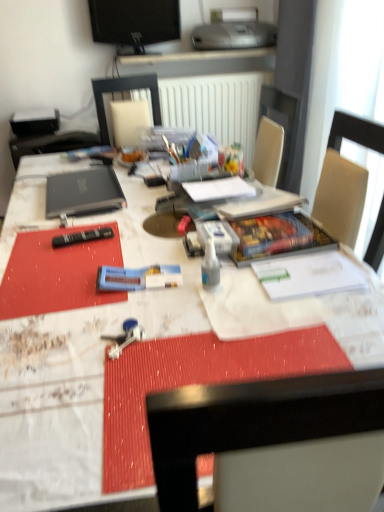
Question: In terms of height, does transparent plastic bottle at center look taller or shorter compared to black matte laptop at left?

Choices:
 (A) short
 (B) tall

Answer: (B)

Question: In the image, is transparent plastic bottle at center on the left side or the right side of black matte laptop at left?

Choices:
 (A) right
 (B) left

Answer: (A)

Question: Considering the real-world distances, which object is closest to the white paper at center?

Choices:
 (A) black matte laptop at left
 (B) silver metallic printer at upper center
 (C) blue plastic toothpaste tube at center
 (D) transparent plastic bottle at center
 (E) black glossy monitor at upper center

Answer: (A)

Question: Considering the real-world distances, which object is closest to the white glossy desk at center?

Choices:
 (A) silver metallic printer at upper center
 (B) transparent plastic bottle at center
 (C) black matte laptop at left
 (D) blue plastic toothpaste tube at center
 (E) white paper at center

Answer: (C)